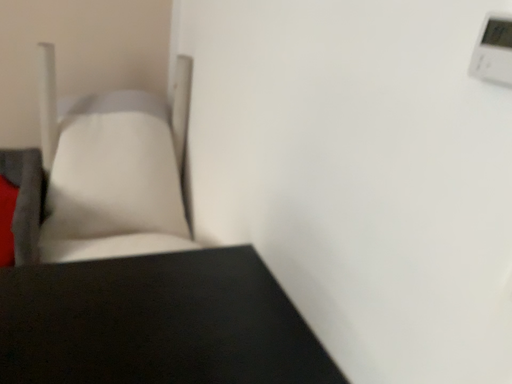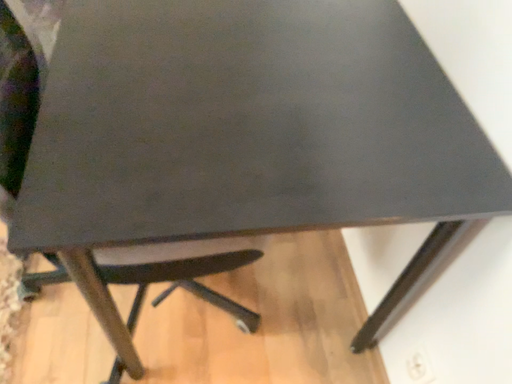
Question: How did the camera likely rotate when shooting the video?

Choices:
 (A) rotated left
 (B) rotated right

Answer: (A)